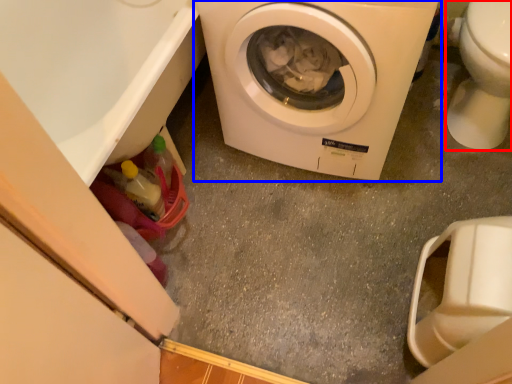
Question: Which object is closer to the camera taking this photo, toilet bowl (highlighted by a red box) or washing machine (highlighted by a blue box)?

Choices:
 (A) toilet bowl
 (B) washing machine

Answer: (B)